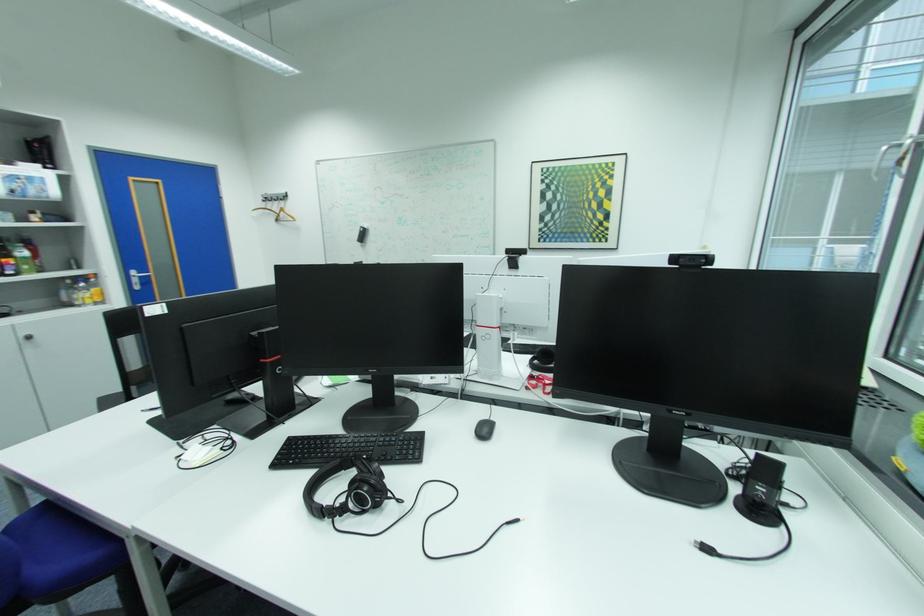
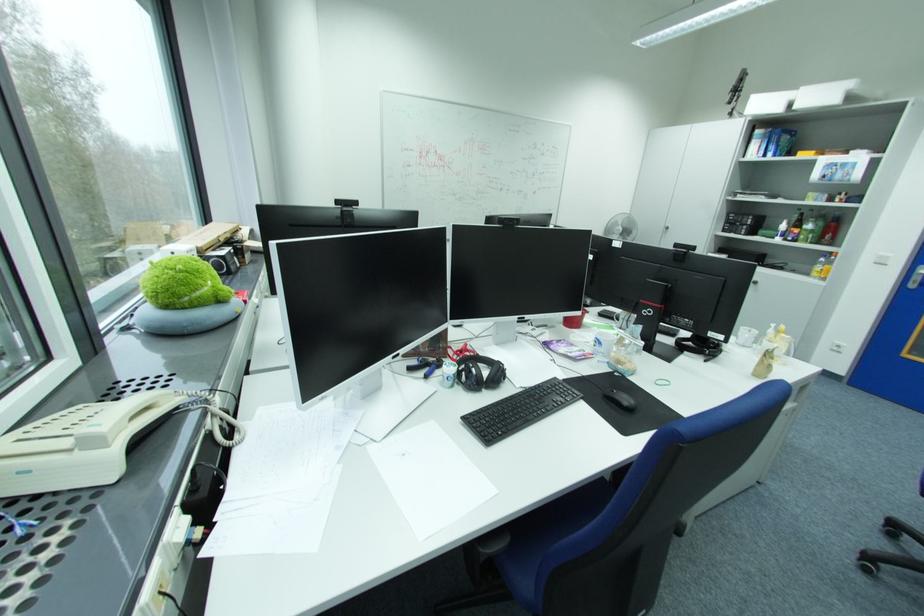
Where in the second image is the point corresponding to point 40,338 from the first image?

(763, 283)